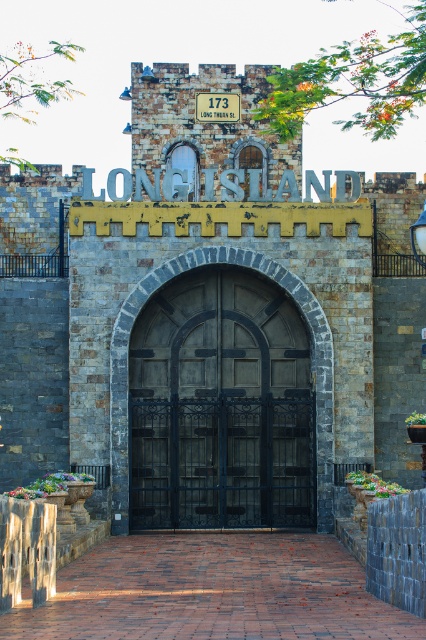
You are standing at the entrance of the castle gate. There is a point marked at coordinates (221, 406). What object is located at that point?

The point at coordinates (221, 406) marks the dark wood gate at center.

You are a painter who needs to decide which object to paint first. Since you want to paint the wider object first, which one should you choose between the dark wood gate at center and the white brick sign at center?

The dark wood gate at center is wider than the white brick sign at center, so you should paint the dark wood gate at center first.